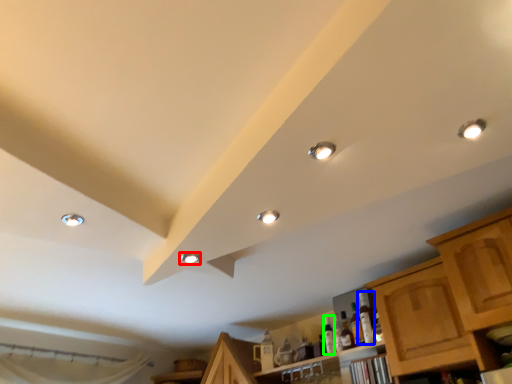
Question: Which object is the closest to the droplight (highlighted by a red box)? Choose among these: bottle (highlighted by a blue box) or bottle (highlighted by a green box).

Choices:
 (A) bottle
 (B) bottle

Answer: (A)